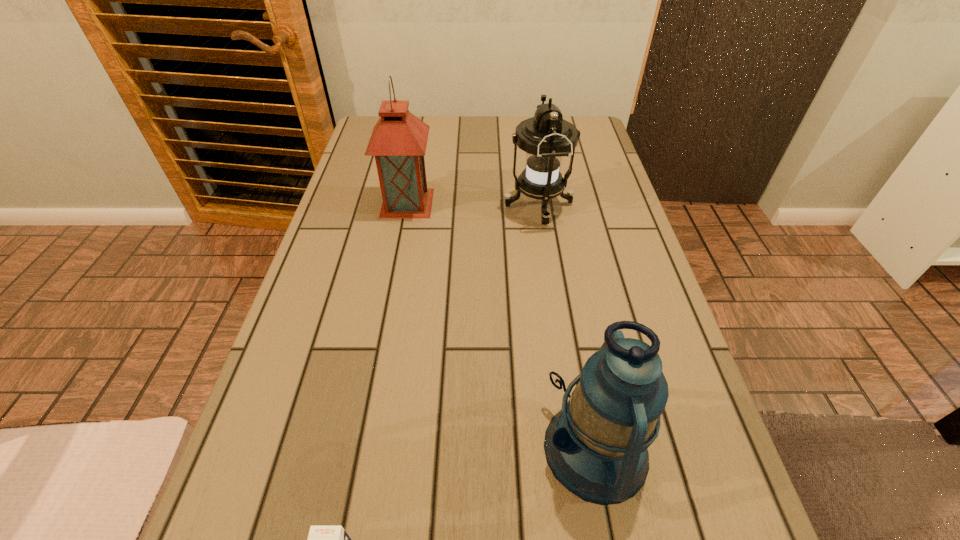
The width and height of the screenshot is (960, 540). In order to click on the leftmost lantern in this screenshot , I will do `click(399, 139)`.

At what (x,y) coordinates should I click in order to perform the action: click on the third farthest object. Please return your answer as a coordinate pair (x, y). Looking at the image, I should click on (596, 446).

The height and width of the screenshot is (540, 960). In order to click on vacant space located on the back of the leftmost lantern in this screenshot , I will do `click(415, 163)`.

The image size is (960, 540). I want to click on vacant space located 0.350m on the face of the second nearest object, so pyautogui.click(x=327, y=449).

Identify the location of vacant region located 0.150m on the face of the second nearest object. The height and width of the screenshot is (540, 960). (451, 449).

Locate an element on the screen. This screenshot has height=540, width=960. vacant space located on the face of the second nearest object is located at coordinates (489, 449).

Image resolution: width=960 pixels, height=540 pixels. What are the coordinates of `object that is at the left edge` in the screenshot? It's located at (399, 139).

In the image, there is a desktop. Where is `vacant space at the far edge`? The height and width of the screenshot is (540, 960). vacant space at the far edge is located at coordinates (506, 117).

Where is `vacant space at the left edge of the desktop`? This screenshot has width=960, height=540. vacant space at the left edge of the desktop is located at coordinates (349, 275).

This screenshot has width=960, height=540. Find the location of `vacant region at the far right corner of the desktop`. vacant region at the far right corner of the desktop is located at coordinates (590, 129).